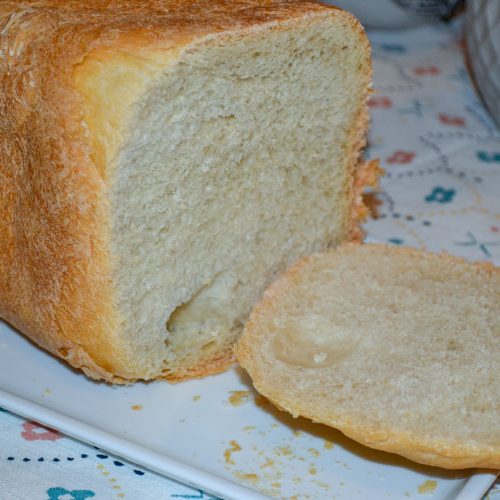
Where is `red designs on tablecloth`? The image size is (500, 500). red designs on tablecloth is located at coordinates (48, 441), (409, 155), (461, 123), (434, 69), (388, 103).